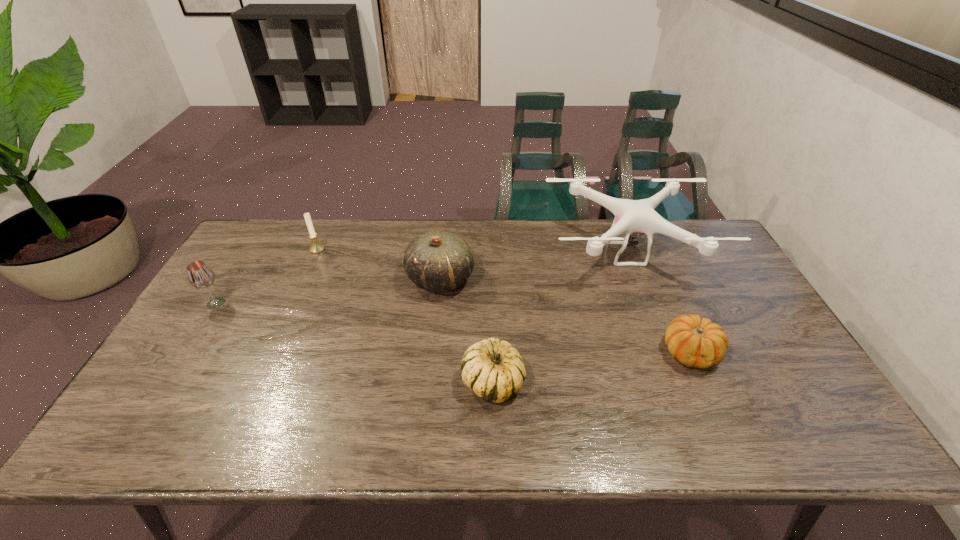
The width and height of the screenshot is (960, 540). In order to click on drone in this screenshot , I will do (631, 216).

Locate an element on the screen. the farthest gourd is located at coordinates (439, 261).

This screenshot has width=960, height=540. I want to click on candle holder, so click(x=316, y=248).

At what (x,y) coordinates should I click in order to perform the action: click on the leftmost object. Please return your answer as a coordinate pair (x, y). This screenshot has width=960, height=540. Looking at the image, I should click on (200, 275).

Where is `the fifth tallest object`? This screenshot has width=960, height=540. the fifth tallest object is located at coordinates (493, 369).

Locate an element on the screen. the rightmost gourd is located at coordinates (696, 342).

In order to click on the shortest gourd in this screenshot , I will do `click(696, 342)`.

Find the location of a particular element. The width and height of the screenshot is (960, 540). free region located on the top of the drone is located at coordinates (673, 374).

I want to click on vacant region located on the right of the tallest gourd, so click(510, 278).

You are a GUI agent. You are given a task and a screenshot of the screen. Output one action in this format:
    pyautogui.click(x=<x>, y=<y>)
    Task: Click on the vacant area located on the right of the candle holder
    The image size is (960, 540).
    Given the screenshot: What is the action you would take?
    pyautogui.click(x=431, y=249)